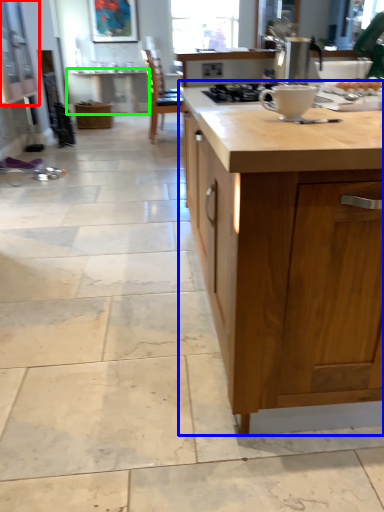
Question: Which object is positioned closest to cabinetry (highlighted by a red box)? Select from countertop (highlighted by a blue box) and table (highlighted by a green box).

Choices:
 (A) countertop
 (B) table

Answer: (B)